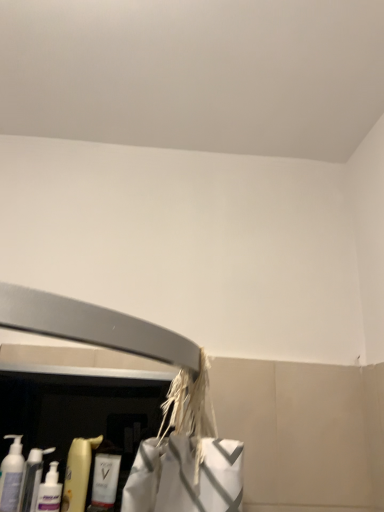
Question: Is the surface of translucent plastic bottles at lower left, acting as the third cleaning product starting from the right, in direct contact with white glossy bottle at lower left, the 4th cleaning product viewed from the left?

Choices:
 (A) yes
 (B) no

Answer: (B)

Question: Is translucent plastic bottles at lower left, acting as the third cleaning product starting from the right, looking in the opposite direction of white glossy bottle at lower left, the 4th cleaning product viewed from the left?

Choices:
 (A) yes
 (B) no

Answer: (B)

Question: Is translucent plastic bottles at lower left, acting as the third cleaning product starting from the right, outside white glossy bottle at lower left, which is the 1th cleaning product from right to left?

Choices:
 (A) no
 (B) yes

Answer: (B)

Question: Does translucent plastic bottles at lower left, acting as the third cleaning product starting from the right, come in front of white glossy bottle at lower left, the 4th cleaning product viewed from the left?

Choices:
 (A) no
 (B) yes

Answer: (B)

Question: Are translucent plastic bottles at lower left, acting as the third cleaning product starting from the right, and white glossy bottle at lower left, which is the 1th cleaning product from right to left, far apart?

Choices:
 (A) no
 (B) yes

Answer: (A)

Question: Is translucent plastic pump bottle at lower left, arranged as the first cleaning product when viewed from the left, in front of or behind translucent plastic bottle at lower left, the 2th cleaning product from the right, in the image?

Choices:
 (A) behind
 (B) front

Answer: (B)

Question: Looking at their shapes, would you say translucent plastic pump bottle at lower left, the fourth cleaning product when ordered from right to left, is wider or thinner than translucent plastic bottle at lower left, which is counted as the 3th cleaning product, starting from the left?

Choices:
 (A) thin
 (B) wide

Answer: (A)

Question: From their relative heights in the image, would you say translucent plastic pump bottle at lower left, the fourth cleaning product when ordered from right to left, is taller or shorter than translucent plastic bottle at lower left, which is counted as the 3th cleaning product, starting from the left?

Choices:
 (A) tall
 (B) short

Answer: (B)

Question: Would you say translucent plastic pump bottle at lower left, arranged as the first cleaning product when viewed from the left, is to the left or to the right of translucent plastic bottle at lower left, the 2th cleaning product from the right, in the picture?

Choices:
 (A) left
 (B) right

Answer: (A)

Question: From a real-world perspective, is white glossy bottle at lower left, the 4th cleaning product viewed from the left, physically located above or below translucent plastic bottles at lower left, acting as the third cleaning product starting from the right?

Choices:
 (A) below
 (B) above

Answer: (B)

Question: In terms of size, does white glossy bottle at lower left, the 4th cleaning product viewed from the left, appear bigger or smaller than translucent plastic bottles at lower left, which is the 2th cleaning product from left to right?

Choices:
 (A) small
 (B) big

Answer: (A)

Question: In the image, is white glossy bottle at lower left, the 4th cleaning product viewed from the left, positioned in front of or behind translucent plastic bottles at lower left, acting as the third cleaning product starting from the right?

Choices:
 (A) behind
 (B) front

Answer: (A)

Question: Is white glossy bottle at lower left, which is the 1th cleaning product from right to left, taller or shorter than translucent plastic bottles at lower left, acting as the third cleaning product starting from the right?

Choices:
 (A) short
 (B) tall

Answer: (B)

Question: From a real-world perspective, is translucent plastic bottles at lower left, acting as the third cleaning product starting from the right, physically located above or below translucent plastic bottle at lower left, the 2th cleaning product from the right?

Choices:
 (A) below
 (B) above

Answer: (A)

Question: Considering the positions of translucent plastic bottles at lower left, acting as the third cleaning product starting from the right, and translucent plastic bottle at lower left, the 2th cleaning product from the right, in the image, is translucent plastic bottles at lower left, acting as the third cleaning product starting from the right, wider or thinner than translucent plastic bottle at lower left, the 2th cleaning product from the right,?

Choices:
 (A) wide
 (B) thin

Answer: (B)